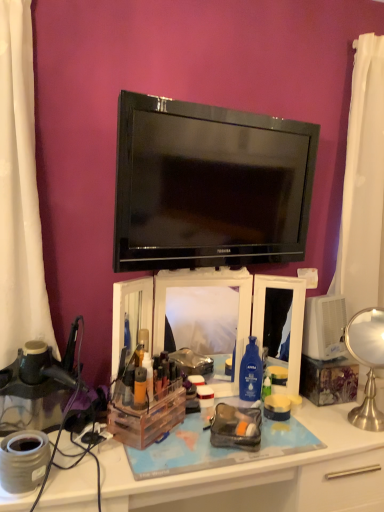
Question: Should I look upward or downward to see clear plastic organizer at center?

Choices:
 (A) down
 (B) up

Answer: (A)

Question: Is matte orange bottle at center, marked as the 2th toiletry in a back-to-front arrangement, closer to the viewer compared to clear plastic makeup organizer at center?

Choices:
 (A) yes
 (B) no

Answer: (A)

Question: Can you confirm if matte orange bottle at center, marked as the 2th toiletry in a back-to-front arrangement, is positioned to the right of clear plastic makeup organizer at center?

Choices:
 (A) no
 (B) yes

Answer: (A)

Question: Can you confirm if matte orange bottle at center, which is the first toiletry in front-to-back order, is bigger than clear plastic makeup organizer at center?

Choices:
 (A) yes
 (B) no

Answer: (B)

Question: From a real-world perspective, is matte orange bottle at center, which is the first toiletry in front-to-back order, beneath clear plastic makeup organizer at center?

Choices:
 (A) yes
 (B) no

Answer: (A)

Question: Is matte orange bottle at center, which is the first toiletry in front-to-back order, beside clear plastic makeup organizer at center?

Choices:
 (A) yes
 (B) no

Answer: (B)

Question: Considering the relative sizes of matte orange bottle at center, marked as the 2th toiletry in a back-to-front arrangement, and clear plastic makeup organizer at center in the image provided, is matte orange bottle at center, marked as the 2th toiletry in a back-to-front arrangement, shorter than clear plastic makeup organizer at center?

Choices:
 (A) no
 (B) yes

Answer: (B)

Question: Is clear plastic organizer at center wider than matte orange bottle at center, which is the first toiletry in front-to-back order?

Choices:
 (A) yes
 (B) no

Answer: (A)

Question: Is clear plastic organizer at center positioned behind matte orange bottle at center, which is the first toiletry in front-to-back order?

Choices:
 (A) yes
 (B) no

Answer: (B)

Question: Can matte orange bottle at center, marked as the 2th toiletry in a back-to-front arrangement, be found inside clear plastic organizer at center?

Choices:
 (A) no
 (B) yes

Answer: (A)

Question: Is clear plastic organizer at center oriented towards matte orange bottle at center, marked as the 2th toiletry in a back-to-front arrangement?

Choices:
 (A) yes
 (B) no

Answer: (B)

Question: Is clear plastic organizer at center to the right of matte orange bottle at center, which is the first toiletry in front-to-back order, from the viewer's perspective?

Choices:
 (A) yes
 (B) no

Answer: (A)

Question: Is clear plastic organizer at center in front of matte orange bottle at center, which is the first toiletry in front-to-back order?

Choices:
 (A) no
 (B) yes

Answer: (B)

Question: Is translucent plastic container at center, the second toiletry viewed from the front, smaller than black glossy tv at center?

Choices:
 (A) yes
 (B) no

Answer: (A)